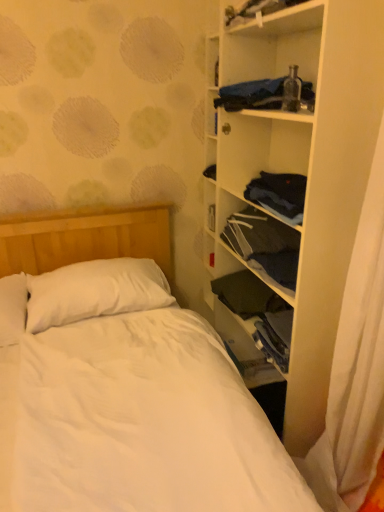
Question: Considering the relative sizes of blue fabric at upper right, which is the 1th clothing from top to bottom, and white matte shelf at right in the image provided, is blue fabric at upper right, which is the 1th clothing from top to bottom, taller than white matte shelf at right?

Choices:
 (A) no
 (B) yes

Answer: (A)

Question: Can you confirm if blue fabric at upper right, which is counted as the third clothing, starting from the bottom, is positioned to the left of white matte shelf at right?

Choices:
 (A) no
 (B) yes

Answer: (B)

Question: Is blue fabric at upper right, which is counted as the third clothing, starting from the bottom, smaller than white matte shelf at right?

Choices:
 (A) yes
 (B) no

Answer: (A)

Question: Is the depth of blue fabric at upper right, which is counted as the third clothing, starting from the bottom, greater than that of white matte shelf at right?

Choices:
 (A) yes
 (B) no

Answer: (A)

Question: Could white matte shelf at right be considered to be inside blue fabric at upper right, which is the 1th clothing from top to bottom?

Choices:
 (A) no
 (B) yes

Answer: (A)

Question: Is white matte shelf at right inside the boundaries of dark blue fabric at center right, the 2th clothing when ordered from bottom to top, or outside?

Choices:
 (A) inside
 (B) outside

Answer: (B)

Question: Would you say white matte shelf at right is to the left or to the right of dark blue fabric at center right, positioned as the second clothing in top-to-bottom order, in the picture?

Choices:
 (A) left
 (B) right

Answer: (B)

Question: Is white matte shelf at right wider or thinner than dark blue fabric at center right, the 2th clothing when ordered from bottom to top?

Choices:
 (A) thin
 (B) wide

Answer: (B)

Question: From a real-world perspective, relative to dark blue fabric at center right, positioned as the second clothing in top-to-bottom order, is white matte shelf at right vertically above or below?

Choices:
 (A) above
 (B) below

Answer: (A)

Question: Looking at their shapes, would you say white soft pillow at upper left is wider or thinner than blue fabric at upper right, which is the 1th clothing from top to bottom?

Choices:
 (A) thin
 (B) wide

Answer: (B)

Question: Relative to blue fabric at upper right, which is counted as the third clothing, starting from the bottom, is white soft pillow at upper left in front or behind?

Choices:
 (A) behind
 (B) front

Answer: (A)

Question: From a real-world perspective, relative to blue fabric at upper right, which is counted as the third clothing, starting from the bottom, is white soft pillow at upper left vertically above or below?

Choices:
 (A) below
 (B) above

Answer: (A)

Question: From their relative heights in the image, would you say white soft pillow at upper left is taller or shorter than blue fabric at upper right, which is the 1th clothing from top to bottom?

Choices:
 (A) short
 (B) tall

Answer: (B)

Question: Relative to dark blue fabric at center-right, positioned as the first clothing in bottom-to-top order, is white matte shelf at right in front or behind?

Choices:
 (A) behind
 (B) front

Answer: (B)

Question: In terms of height, does white matte shelf at right look taller or shorter compared to dark blue fabric at center-right, positioned as the first clothing in bottom-to-top order?

Choices:
 (A) short
 (B) tall

Answer: (B)